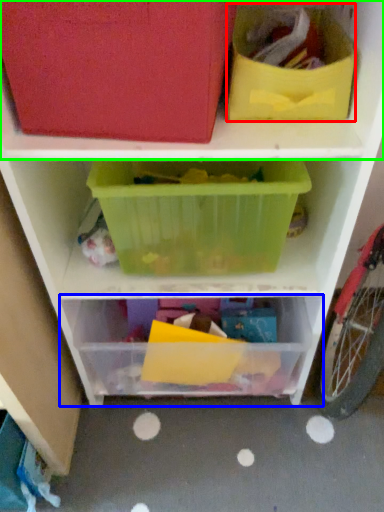
Question: Considering the real-world distances, which object is closest to storage box (highlighted by a red box)? shelf (highlighted by a blue box) or shelf (highlighted by a green box).

Choices:
 (A) shelf
 (B) shelf

Answer: (B)